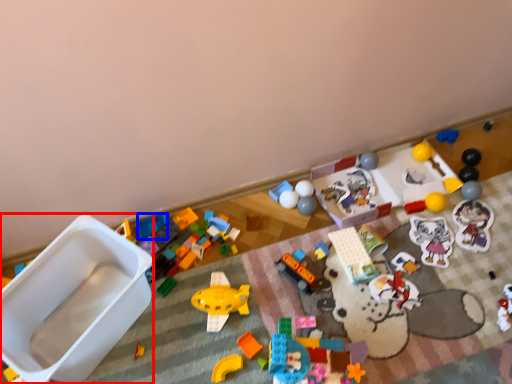
Question: Which of the following is the closest to the observer, toy (highlighted by a red box) or toy (highlighted by a blue box)?

Choices:
 (A) toy
 (B) toy

Answer: (A)